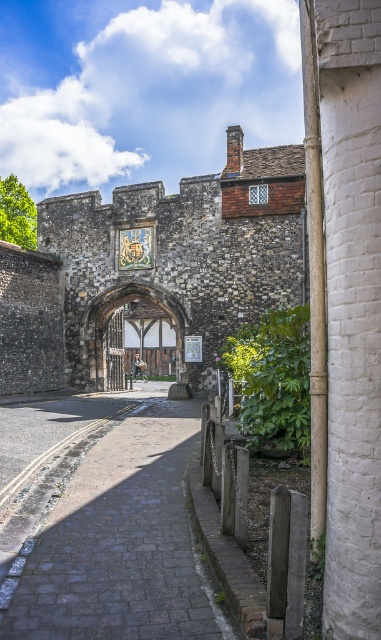
Who is more distant from viewer, (145, 529) or (172, 356)?

Positioned behind is point (172, 356).

Is gray cobblestone path at center behind wooden timber archway at center?

No, gray cobblestone path at center is closer to the viewer.

You are a GUI agent. You are given a task and a screenshot of the screen. Output one action in this format:
    pyautogui.click(x=<x>, y=<y>)
    Task: Click on the gray cobblestone path at center
    Image resolution: width=381 pixels, height=640 pixels.
    Given the screenshot: What is the action you would take?
    pyautogui.click(x=120, y=541)

In order to click on gray cobblestone path at center in this screenshot , I will do `click(120, 541)`.